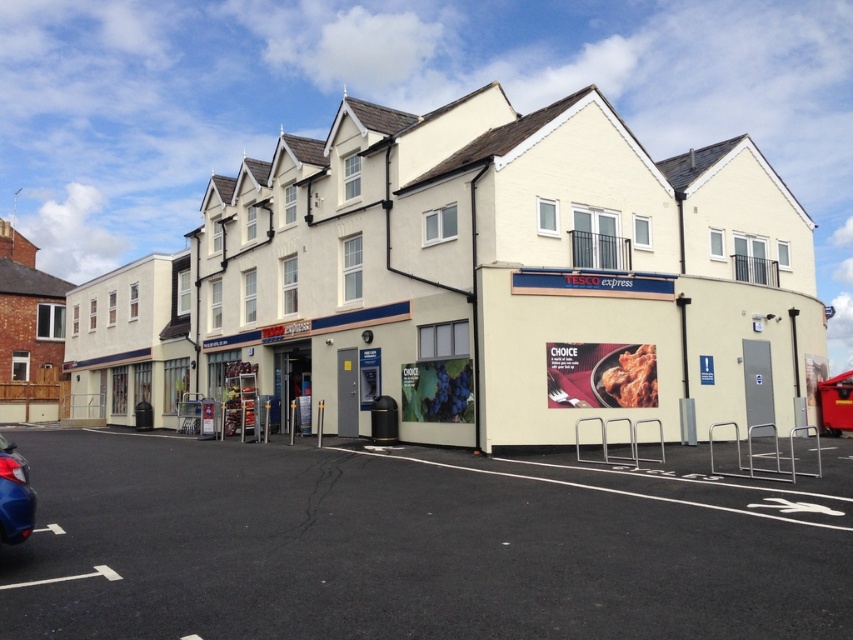
You are a delivery driver who needs to park your truck in the black asphalt parking lot at lower center. However, there is a metallic blue car at lower left blocking the entrance. Can you drive your truck into the parking lot without moving the car?

The black asphalt parking lot at lower center is in front of the metallic blue car at lower left, meaning the car is blocking the entrance. Therefore, you cannot drive your truck into the parking lot without moving the car.

You are standing in front of the Tesco Express building and want to move from point 1 to point 2. Given that point 1 is at coordinates point (308, 483) and point 2 is at point (16, 515), which direction should you move to get closer to point 2?

You should move downward and to the right because point (16, 515) is closer to the entrance and lower on the image compared to point (308, 483).